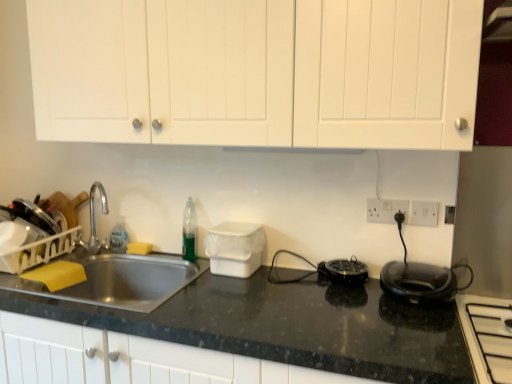
Question: From a real-world perspective, is black plastic appliance at center, which ranks as the first appliance in right-to-left order, physically above translucent green bottle at sink?

Choices:
 (A) no
 (B) yes

Answer: (A)

Question: Is black plastic appliance at center, which ranks as the first appliance in right-to-left order, behind translucent green bottle at sink?

Choices:
 (A) yes
 (B) no

Answer: (B)

Question: Could translucent green bottle at sink be considered to be inside black plastic appliance at center, which ranks as the first appliance in right-to-left order?

Choices:
 (A) no
 (B) yes

Answer: (A)

Question: Is black plastic appliance at center, the second appliance in the left-to-right sequence, wider than translucent green bottle at sink?

Choices:
 (A) no
 (B) yes

Answer: (B)

Question: Is black plastic appliance at center, the second appliance in the left-to-right sequence, positioned beyond the bounds of translucent green bottle at sink?

Choices:
 (A) no
 (B) yes

Answer: (B)

Question: Would you say translucent green bottle at sink is to the left or to the right of white matte cabinet doors at upper center in the picture?

Choices:
 (A) right
 (B) left

Answer: (B)

Question: Which is correct: translucent green bottle at sink is inside white matte cabinet doors at upper center, or outside of it?

Choices:
 (A) outside
 (B) inside

Answer: (A)

Question: From the image's perspective, is translucent green bottle at sink above or below white matte cabinet doors at upper center?

Choices:
 (A) below
 (B) above

Answer: (A)

Question: From a real-world perspective, is translucent green bottle at sink positioned above or below white matte cabinet doors at upper center?

Choices:
 (A) above
 (B) below

Answer: (B)

Question: Is white plastic electric outlet at upper right, positioned as the second electric outlet in left-to-right order, inside or outside of white plastic electric outlet at right, which is the 1th electric outlet in left-to-right order?

Choices:
 (A) inside
 (B) outside

Answer: (B)

Question: From a real-world perspective, relative to white plastic electric outlet at right, which ranks as the second electric outlet in right-to-left order, is white plastic electric outlet at upper right, marked as the first electric outlet in a right-to-left arrangement, vertically above or below?

Choices:
 (A) below
 (B) above

Answer: (B)

Question: Is white plastic electric outlet at upper right, positioned as the second electric outlet in left-to-right order, to the left or to the right of white plastic electric outlet at right, which is the 1th electric outlet in left-to-right order, in the image?

Choices:
 (A) right
 (B) left

Answer: (A)

Question: Is white plastic electric outlet at upper right, marked as the first electric outlet in a right-to-left arrangement, bigger or smaller than white plastic electric outlet at right, which ranks as the second electric outlet in right-to-left order?

Choices:
 (A) small
 (B) big

Answer: (A)

Question: Based on their sizes in the image, would you say white plastic electric outlet at upper right, positioned as the second electric outlet in left-to-right order, is bigger or smaller than black plastic appliance at center, the second appliance in the left-to-right sequence?

Choices:
 (A) big
 (B) small

Answer: (B)

Question: Is white plastic electric outlet at upper right, positioned as the second electric outlet in left-to-right order, in front of or behind black plastic appliance at center, which ranks as the first appliance in right-to-left order, in the image?

Choices:
 (A) front
 (B) behind

Answer: (B)